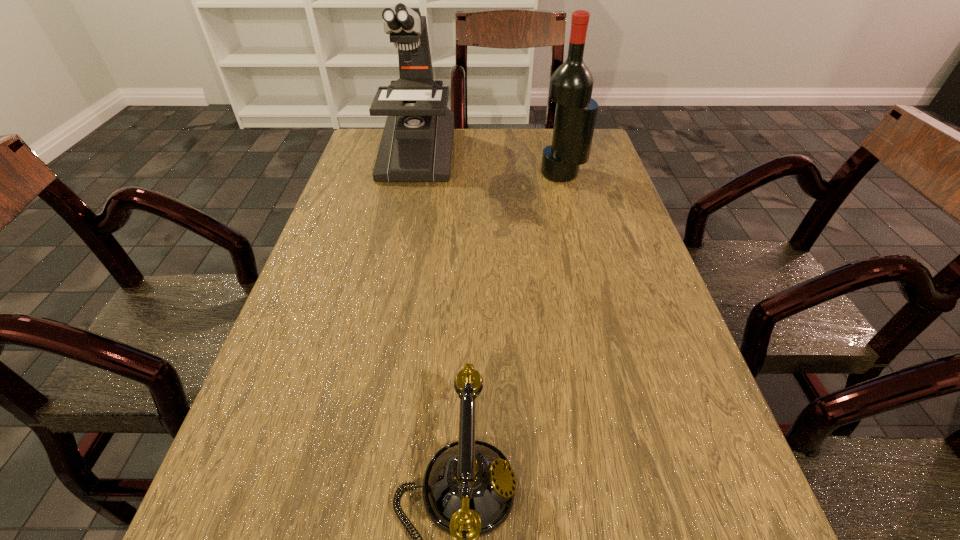
Locate an element on the screen. This screenshot has width=960, height=540. microscope is located at coordinates (416, 146).

Locate an element on the screen. the rightmost object is located at coordinates (571, 85).

At what (x,y) coordinates should I click in order to perform the action: click on vacant space located through the eyepieces of the microscope. Please return your answer as a coordinate pair (x, y). The height and width of the screenshot is (540, 960). Looking at the image, I should click on (391, 275).

Identify the location of free space located on the front of the wine bottle. [583, 251].

I want to click on microscope that is at the far edge, so click(x=416, y=146).

Find the location of a particular element. Image resolution: width=960 pixels, height=540 pixels. wine bottle located in the far edge section of the desktop is located at coordinates [x=571, y=85].

Identify the location of object that is positioned at the left edge. (416, 146).

The image size is (960, 540). Identify the location of object located in the right edge section of the desktop. (571, 85).

This screenshot has height=540, width=960. Find the location of `object at the far left corner`. object at the far left corner is located at coordinates (416, 146).

This screenshot has width=960, height=540. Identify the location of object that is at the far right corner. (571, 85).